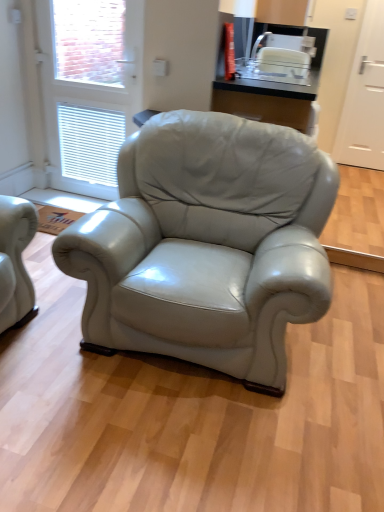
Question: Should I look upward or downward to see white plastic toaster at upper center?

Choices:
 (A) up
 (B) down

Answer: (A)

Question: Can you confirm if white plastic toaster at upper center is positioned to the right of white matte door at right, the 1th screen door from the right?

Choices:
 (A) no
 (B) yes

Answer: (A)

Question: Is white plastic toaster at upper center positioned before white matte door at right, acting as the 2th screen door starting from the left?

Choices:
 (A) yes
 (B) no

Answer: (A)

Question: Does white plastic toaster at upper center have a lesser height compared to white matte door at right, the second screen door viewed from the front?

Choices:
 (A) no
 (B) yes

Answer: (B)

Question: Considering the relative sizes of white plastic toaster at upper center and white matte door at right, the second screen door viewed from the front, in the image provided, is white plastic toaster at upper center smaller than white matte door at right, the second screen door viewed from the front,?

Choices:
 (A) no
 (B) yes

Answer: (B)

Question: Can you confirm if white plastic toaster at upper center is taller than white matte door at right, the 1th screen door from the right?

Choices:
 (A) yes
 (B) no

Answer: (B)

Question: Can we say white plastic toaster at upper center lies outside white matte door at right, acting as the 2th screen door starting from the left?

Choices:
 (A) no
 (B) yes

Answer: (B)

Question: Is white glossy screen door at upper left, the 2th screen door positioned from the back, shorter than white matte door at right, the second screen door viewed from the front?

Choices:
 (A) no
 (B) yes

Answer: (B)

Question: Does white glossy screen door at upper left, the first screen door when ordered from left to right, turn towards white matte door at right, the second screen door viewed from the front?

Choices:
 (A) no
 (B) yes

Answer: (A)

Question: Does white glossy screen door at upper left, which appears as the 1th screen door when viewed from the front, lie in front of white matte door at right, the 1th screen door from the right?

Choices:
 (A) no
 (B) yes

Answer: (B)

Question: From a real-world perspective, is white glossy screen door at upper left, which appears as the 1th screen door when viewed from the front, under white matte door at right, positioned as the first screen door in back-to-front order?

Choices:
 (A) yes
 (B) no

Answer: (A)

Question: Is white matte door at right, the second screen door viewed from the front, at the back of white glossy screen door at upper left, the first screen door when ordered from left to right?

Choices:
 (A) no
 (B) yes

Answer: (A)

Question: Can you confirm if white glossy screen door at upper left, which appears as the 1th screen door when viewed from the front, is positioned to the right of white matte door at right, the 1th screen door from the right?

Choices:
 (A) yes
 (B) no

Answer: (B)

Question: From a real-world perspective, is white glossy screen door at upper left, the 2th screen door positioned from the back, under white plastic toaster at upper center?

Choices:
 (A) yes
 (B) no

Answer: (A)